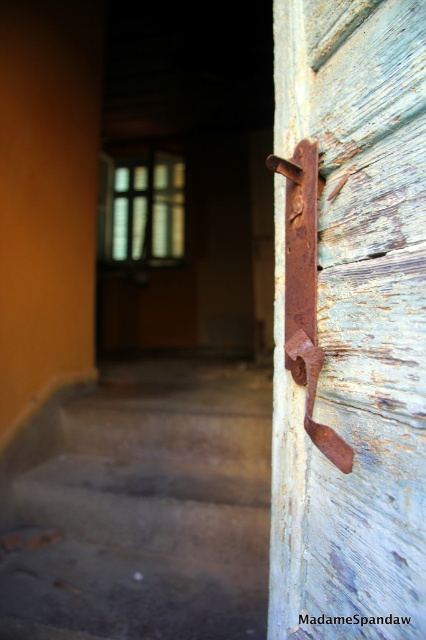
You are a delivery person trying to enter the building through the faded blue door. You need to reach the rusty metal door handle at right to open the door. Can you step onto the concrete stairs at lower left to reach it?

The concrete stairs at lower left is much taller than the rusty metal door handle at right, so stepping onto the concrete stairs at lower left would make it harder to reach the rusty metal door handle at right since it is lower than the stairs.

You are a delivery person carrying a large box that is 1 meter wide. You arrive at the entrance and see the concrete stairs at lower left and the rusty metal door handle at right. Can you fit the box through the space between them?

The concrete stairs at lower left might be wider than the rusty metal door handle at right, so the space between them may be sufficient to fit the 1 meter wide box. However, since the exact width isn not specified, there is some uncertainty.